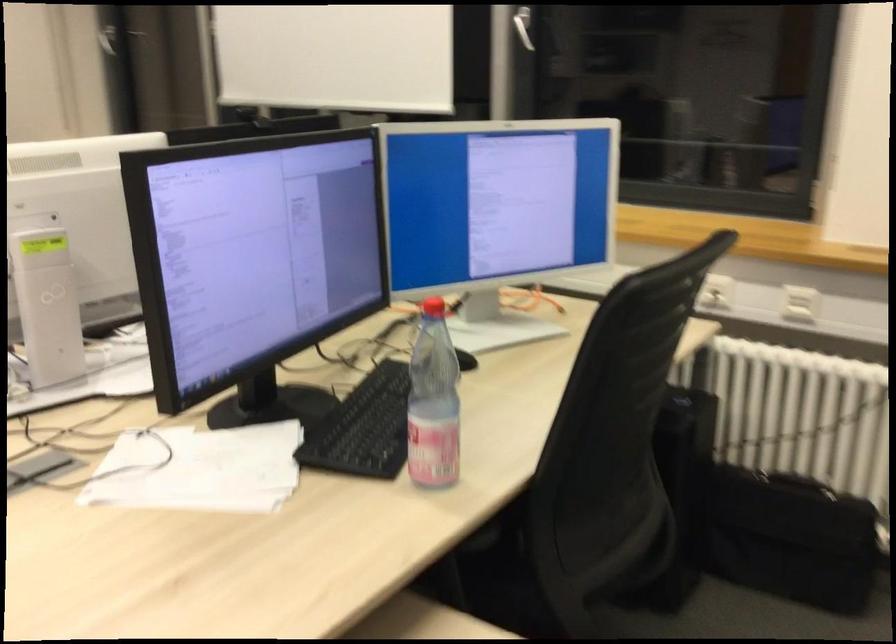
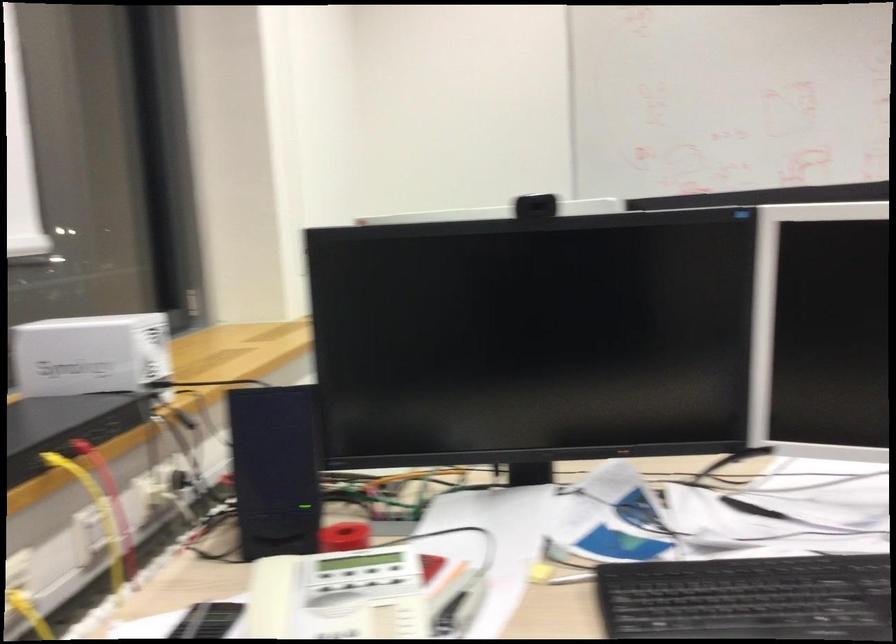
Question: I am providing you with two images of the same scene from different viewpoints. Which of the following objects are not visible in image2?

Choices:
 (A) black computer speaker
 (B) red bottle cap
 (C) white Synology box
 (D) microscope eyepiece

Answer: (B)